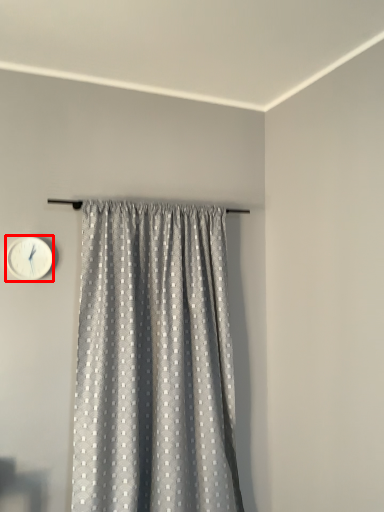
Question: From the image's perspective, what is the correct spatial positioning of wall clock (annotated by the red box) in reference to curtain?

Choices:
 (A) above
 (B) below

Answer: (A)